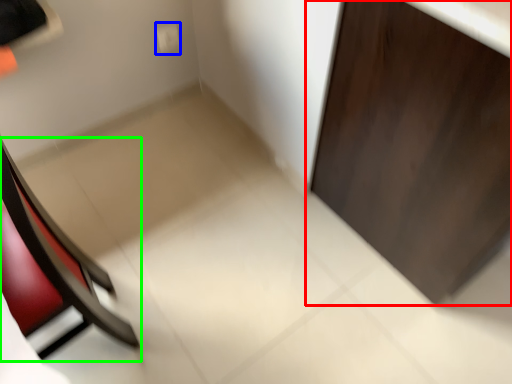
Question: Based on their relative distances, which object is nearer to door (highlighted by a red box)? Choose from electric outlet (highlighted by a blue box) and chair (highlighted by a green box).

Choices:
 (A) electric outlet
 (B) chair

Answer: (B)